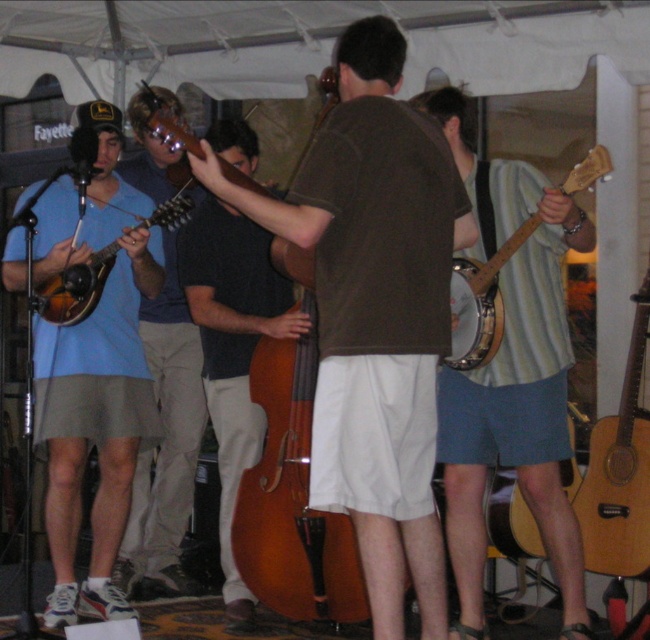
You are a photographer positioned at the center of the scene. You want to take a closeup shot of the acoustic wood guitar at right. Based on its coordinates, in which general direction should you move to get closer to it?

The acoustic wood guitar at right is located at point (619,472). Since the photographer is at the center, which is typically at coordinates around (325,320), moving towards the right and upward would bring the photographer closer to the guitar.

You are a music teacher setting up for a class and need to arrange the brown wooden cello at center and the wooden mandolin at left on a shelf. The shelf has limited height space. Based on the image, which instrument should be placed first to ensure it fits?

The wooden mandolin at left should be placed first because it is shorter than the brown wooden cello at center, which is much taller. This way, the taller cello can be positioned where there is more vertical space available.

You are a stagehand who needs to move the matte brown banjo at left closer to the double bass. The minimum distance required between them for safety is 3 meters. Is the current distance sufficient?

The current distance between the matte brown banjo at left and the double bass is 4.27 meters, which is greater than the required 3 meters. Therefore, the current distance is sufficient.